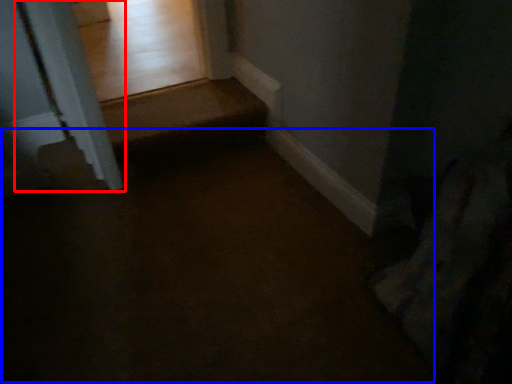
Question: Which object is further to the camera taking this photo, pillar (highlighted by a red box) or path (highlighted by a blue box)?

Choices:
 (A) pillar
 (B) path

Answer: (A)